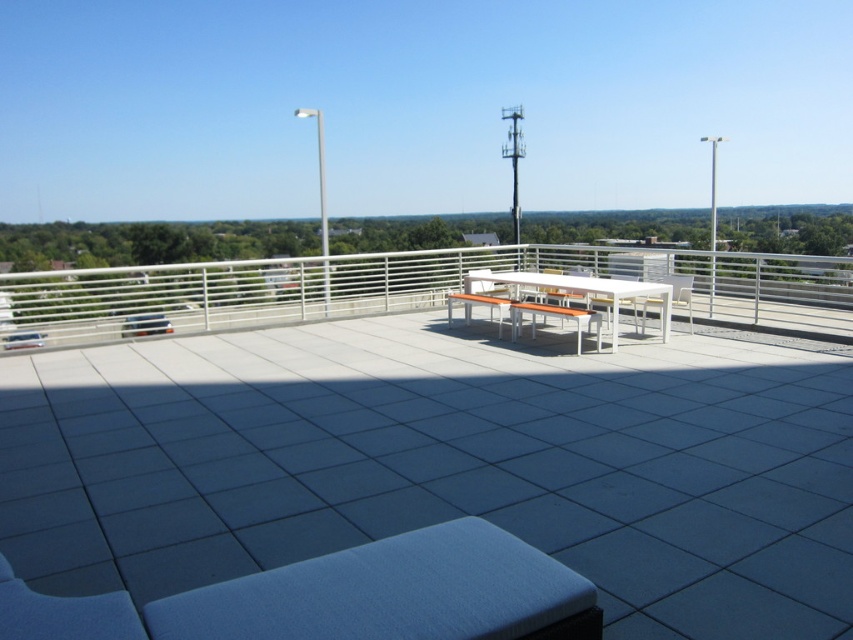
You are standing on the rooftop terrace and want to walk from the white metal railing at upper center to the white matte picnic table at center. Which object will you pass closer to as you move towards the table?

As you move from the white metal railing at upper center to the white matte picnic table at center, you will pass closer to the white matte picnic table at center because it is closer to you than the railing, which is further away.

Looking at this image, you are standing on the rooftop terrace and want to move from the white metal railing at upper center to the white tile deck at center. Which direction should you move in?

You should move to the left to reach the white tile deck at center from the white metal railing at upper center because the white tile deck at center is located to the left of the white metal railing at upper center.